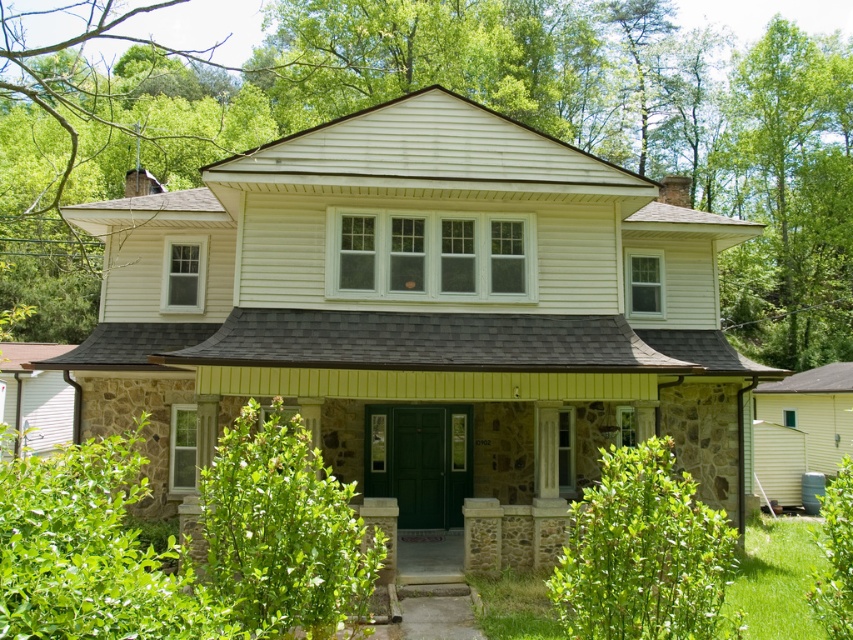
Can you confirm if green leafy tree at upper center is taller than green leafy tree at upper right?

Yes, green leafy tree at upper center is taller than green leafy tree at upper right.

Is point (792, 259) farther from camera compared to point (821, 257)?

No, (792, 259) is in front of (821, 257).

Find the location of a particular element. This screenshot has height=640, width=853. green leafy tree at upper center is located at coordinates (467, 97).